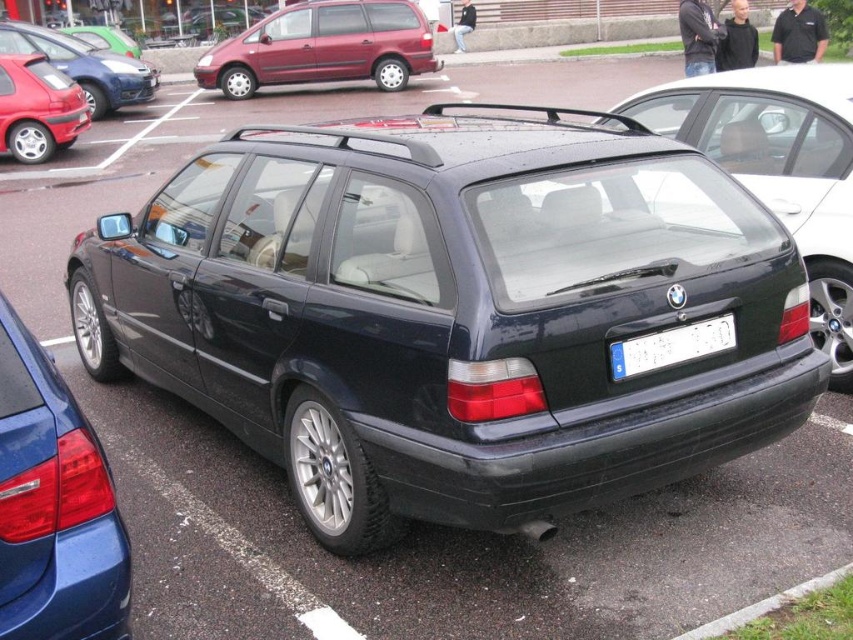
Question: Is matte red hatchback at left above matte black car at left?

Choices:
 (A) yes
 (B) no

Answer: (B)

Question: Does glossy blue car at lower left have a larger size compared to maroon metallic minivan at center?

Choices:
 (A) yes
 (B) no

Answer: (A)

Question: Which of these objects is positioned farthest from the matte black car at left?

Choices:
 (A) white plastic license plate at center
 (B) satin black station wagon at center
 (C) gray concrete curb at lower right

Answer: (C)

Question: Among these points, which one is nearest to the camera?

Choices:
 (A) (734, 621)
 (B) (149, 307)

Answer: (A)

Question: Which point appears closest to the camera in this image?

Choices:
 (A) (206, 88)
 (B) (33, 51)
 (C) (416, 198)

Answer: (C)

Question: Can you confirm if satin black station wagon at center is wider than matte red hatchback at left?

Choices:
 (A) no
 (B) yes

Answer: (B)